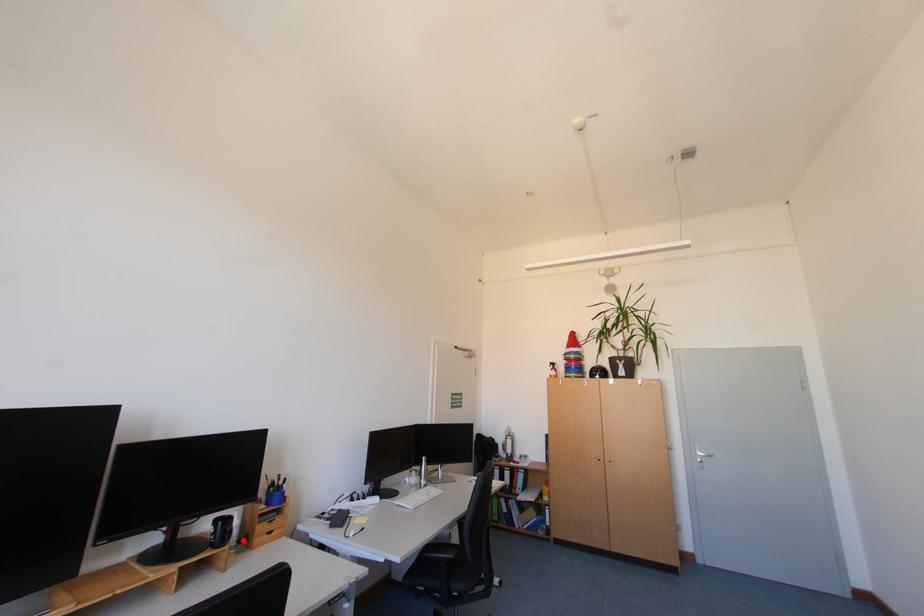
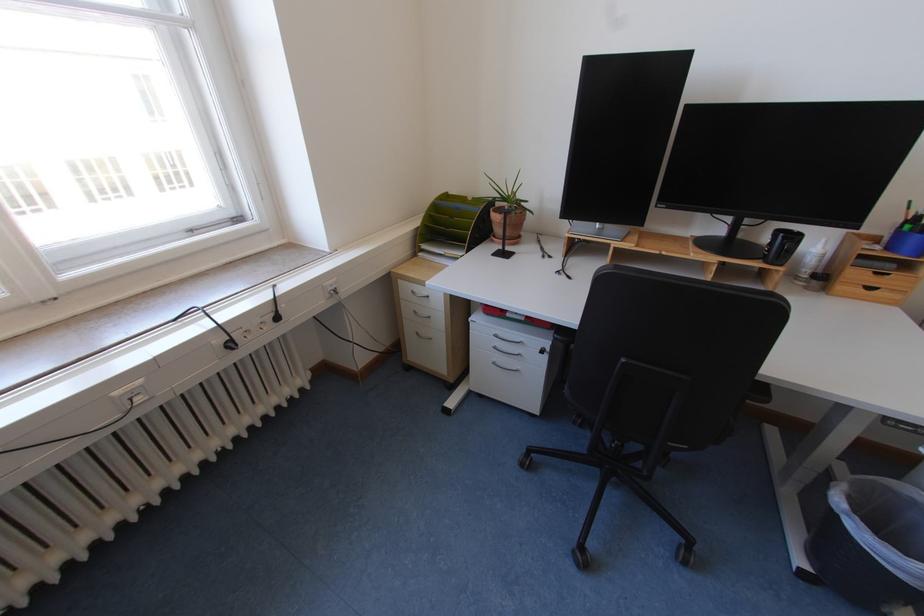
Question: A red point is marked in image1. In image2, is the corresponding 3D point closer to the camera or farther? Reply with the corresponding letter.

Choices:
 (A) The corresponding 3D point is closer.
 (B) The corresponding 3D point is farther.

Answer: (B)